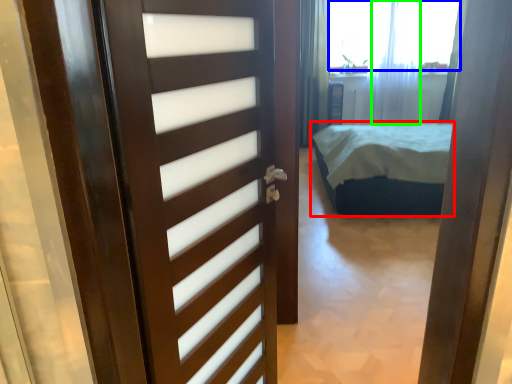
Question: Which object is the farthest from bed (highlighted by a red box)? Choose among these: window screen (highlighted by a blue box) or curtain (highlighted by a green box).

Choices:
 (A) window screen
 (B) curtain

Answer: (A)